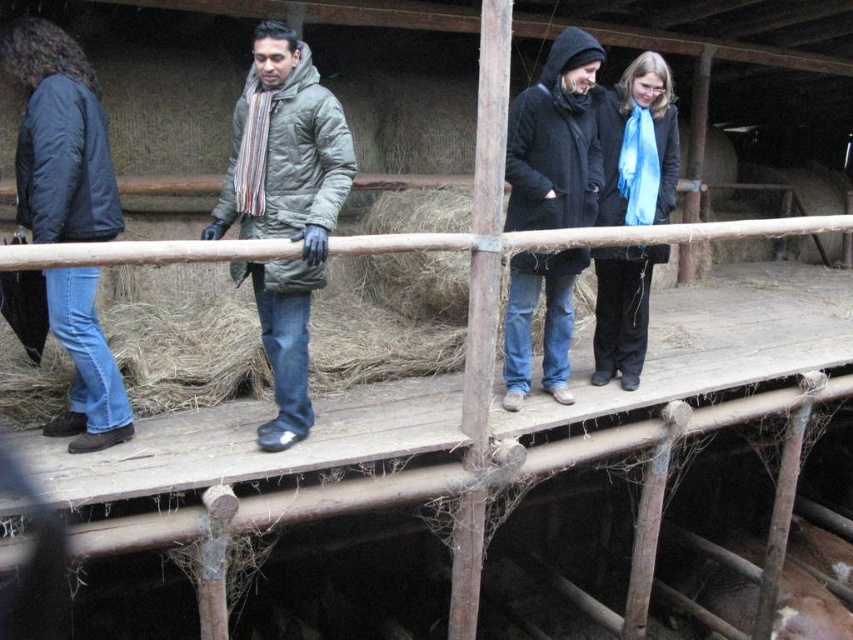
Question: Based on their relative distances, which object is farther from the blue scarf at center?

Choices:
 (A) brown furry pig at lower right
 (B) dark blue woolen coat at center
 (C) gray puffy jacket at center

Answer: (A)

Question: Is gray puffy jacket at center positioned in front of brown furry pig at lower right?

Choices:
 (A) yes
 (B) no

Answer: (A)

Question: Does dark blue jacket at left appear over blue scarf at center?

Choices:
 (A) yes
 (B) no

Answer: (B)

Question: Is dark blue woolen coat at center closer to camera compared to brown furry pig at lower right?

Choices:
 (A) no
 (B) yes

Answer: (B)

Question: Which object is positioned closest to the gray puffy jacket at center?

Choices:
 (A) dark blue woolen coat at center
 (B) blue scarf at center

Answer: (A)

Question: Which point is farther from the camera taking this photo?

Choices:
 (A) (781, 604)
 (B) (550, 205)
 (C) (85, 230)
 (D) (664, 166)

Answer: (A)